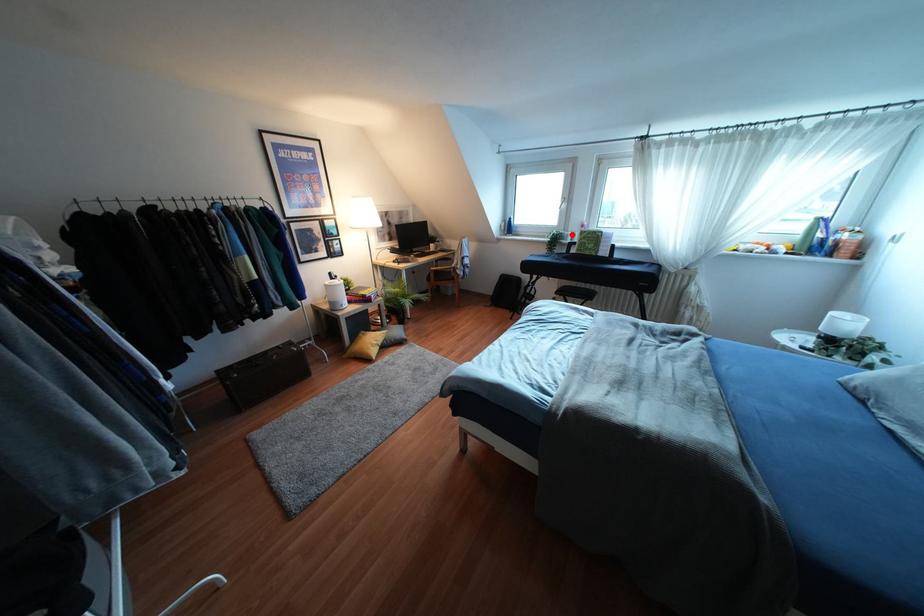
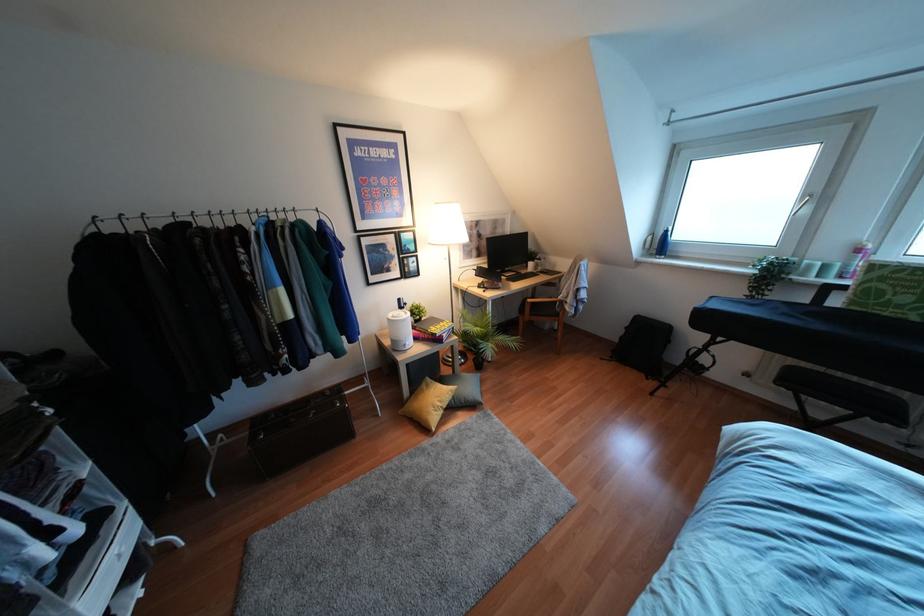
Question: A red point is marked in image1. In image2, is the corresponding 3D point closer to the camera or farther? Reply with the corresponding letter.

Choices:
 (A) The corresponding 3D point is closer.
 (B) The corresponding 3D point is farther.

Answer: (B)